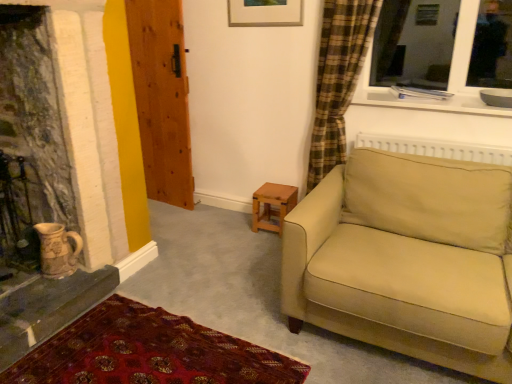
Where is `free spot in front of wooden table at center`? free spot in front of wooden table at center is located at coordinates (263, 237).